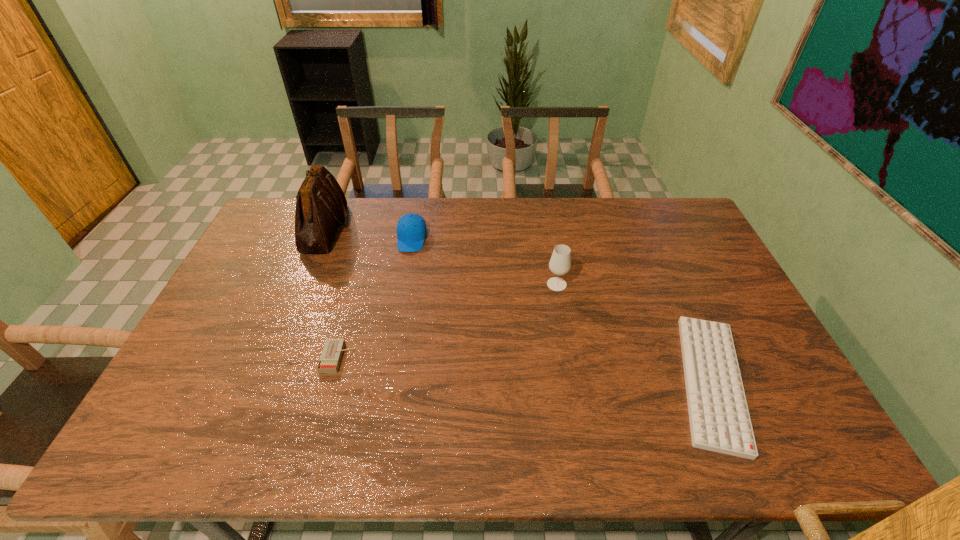
Locate an element on the screen. This screenshot has width=960, height=540. free space in the image that satisfies the following two spatial constraints: 1. on the front-facing side of the cap; 2. on the right side of the rightmost object is located at coordinates 387,381.

Find the location of a particular element. free space that satisfies the following two spatial constraints: 1. on the front side of the leftmost object; 2. on the right side of the computer keyboard is located at coordinates (263, 381).